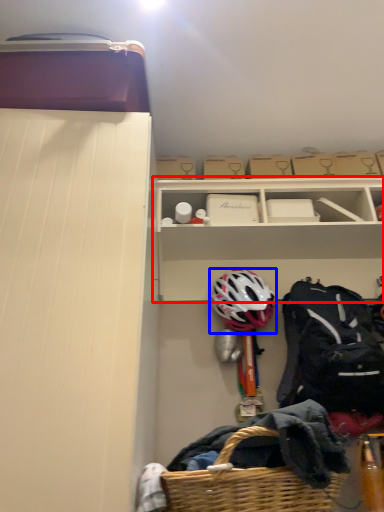
Question: Which object is closer to the camera taking this photo, shelf (highlighted by a red box) or helmet (highlighted by a blue box)?

Choices:
 (A) shelf
 (B) helmet

Answer: (B)